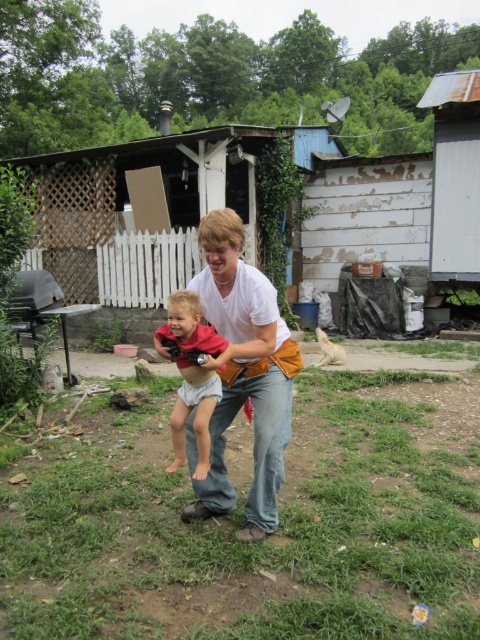
Can you confirm if white cotton shirt at center is positioned to the right of light gray cloth diaper at center?

Indeed, white cotton shirt at center is positioned on the right side of light gray cloth diaper at center.

Between white cotton shirt at center and light gray cloth diaper at center, which one appears on the right side from the viewer's perspective?

Positioned to the right is white cotton shirt at center.

Does point (218, 408) come behind point (190, 314)?

Yes.

Find the location of a particular element. The width and height of the screenshot is (480, 640). white cotton shirt at center is located at coordinates (244, 374).